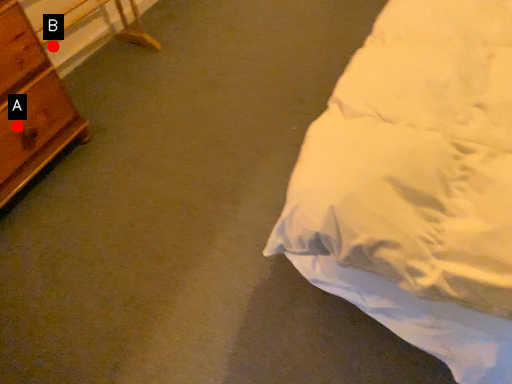
Question: Two points are circled on the image, labeled by A and B beside each circle. Which point appears farthest from the camera in this image?

Choices:
 (A) A is further
 (B) B is further

Answer: (B)